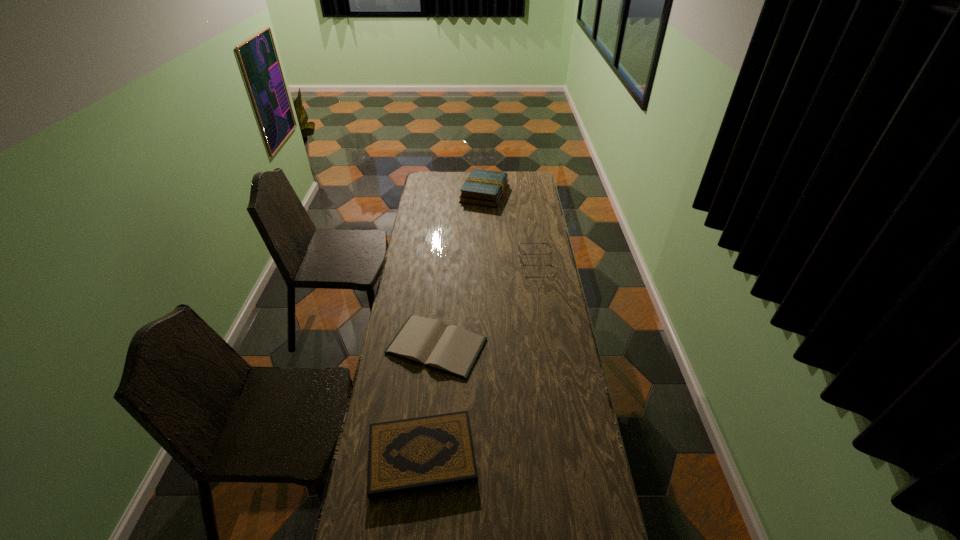
Locate an element on the screen. Image resolution: width=960 pixels, height=540 pixels. empty location between the second nearest object and the second tallest hardback book is located at coordinates (429, 401).

In order to click on vacant point located between the second farthest object and the farthest object in this screenshot , I will do `click(510, 226)`.

You are a GUI agent. You are given a task and a screenshot of the screen. Output one action in this format:
    pyautogui.click(x=<x>, y=<y>)
    Task: Click on the vacant point located between the nearest hardback book and the farthest hardback book
    The height and width of the screenshot is (540, 960).
    Given the screenshot: What is the action you would take?
    (x=453, y=325)

Image resolution: width=960 pixels, height=540 pixels. Find the location of `free point between the shortest hardback book and the nearest hardback book`. free point between the shortest hardback book and the nearest hardback book is located at coordinates click(x=429, y=401).

Find the location of a particular element. The height and width of the screenshot is (540, 960). empty space between the second nearest object and the third nearest object is located at coordinates (487, 302).

Identify the location of free space between the tallest hardback book and the second nearest object. This screenshot has width=960, height=540. (461, 269).

At what (x,y) coordinates should I click in order to perform the action: click on vacant region between the farthest hardback book and the second farthest object. Please return your answer as a coordinate pair (x, y). The height and width of the screenshot is (540, 960). Looking at the image, I should click on (510, 226).

This screenshot has width=960, height=540. What are the coordinates of `free space that is in between the shortest hardback book and the farthest object` in the screenshot? It's located at (461, 269).

Identify the location of vacant space in between the second nearest hardback book and the farthest hardback book. (461, 269).

Identify which object is the nearest to the tallest hardback book. Please provide its 2D coordinates. Your answer should be formatted as a tuple, i.e. [(x, y)], where the tuple contains the x and y coordinates of a point satisfying the conditions above.

[(519, 242)]